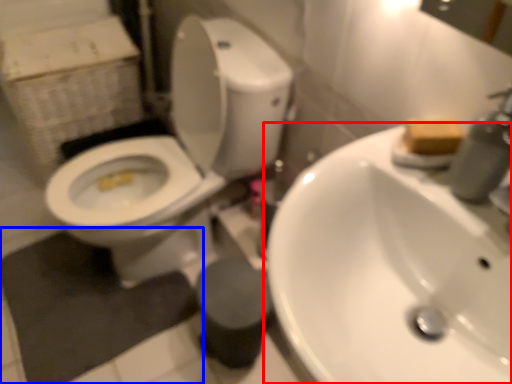
Question: Which point is further to the camera, sink (highlighted by a red box) or bath mat (highlighted by a blue box)?

Choices:
 (A) sink
 (B) bath mat

Answer: (B)